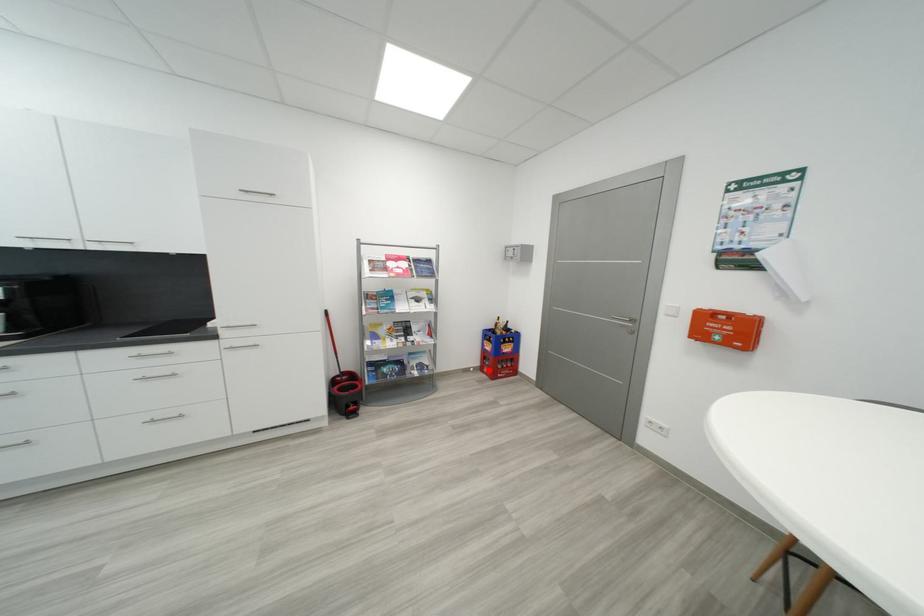
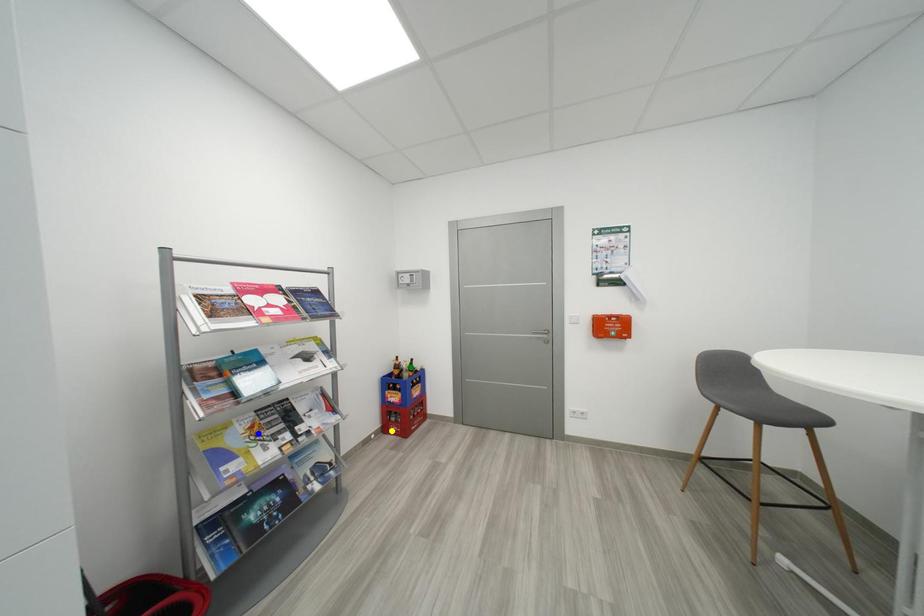
Question: I am providing you with two images of the same scene from different viewpoints. A red point is marked on the first image. You are given multiple points on the second image. In image 2, which mark is for the same physical point as the one in image 1?

Choices:
 (A) yellow point
 (B) green point
 (C) blue point

Answer: (A)